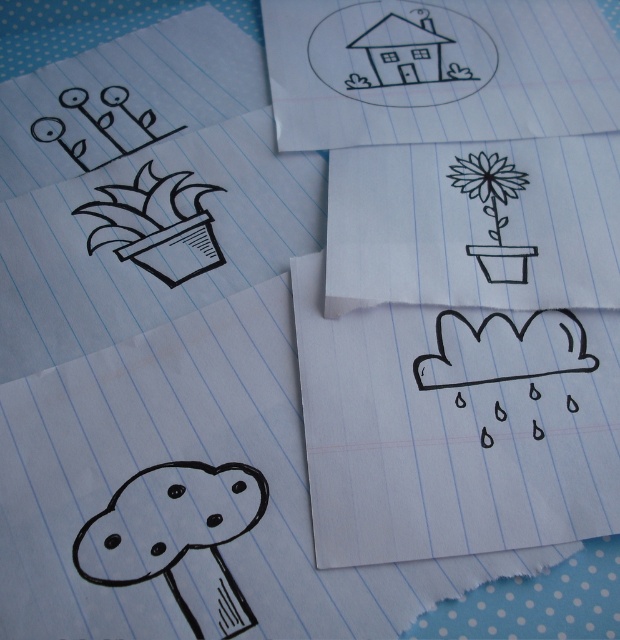
Is the position of black line drawing house at upper center less distant than that of black line drawing flower at center?

No, it is behind black line drawing flower at center.

Between black line drawing house at upper center and black line drawing flower at center, which one appears on the left side from the viewer's perspective?

black line drawing house at upper center is more to the left.

Find the location of `black line drawing house at upper center`. black line drawing house at upper center is located at coordinates (436, 70).

Is point (432, 349) positioned before point (403, 186)?

That is True.

What do you see at coordinates (454, 426) in the screenshot?
I see `black line cloud at center` at bounding box center [454, 426].

Between point (399, 461) and point (404, 216), which one is positioned in front?

Positioned in front is point (399, 461).

Where is `black line cloud at center`? Image resolution: width=620 pixels, height=640 pixels. black line cloud at center is located at coordinates (454, 426).

Looking at this image, who is shorter, black line cloud at center or black line drawing flower at center?

black line drawing flower at center is shorter.

Between black line cloud at center and black line drawing flower at center, which one appears on the left side from the viewer's perspective?

Positioned to the left is black line cloud at center.

Is point (311, 483) closer to viewer compared to point (505, 184)?

Yes, point (311, 483) is in front of point (505, 184).

In order to click on black line cloud at center in this screenshot , I will do `click(454, 426)`.